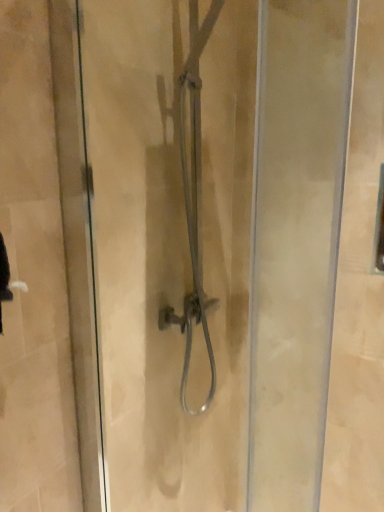
Find the location of `clear glass shower door at center`. clear glass shower door at center is located at coordinates (216, 243).

What is the approximate width of clear glass shower door at center?

The width of clear glass shower door at center is 2.36 inches.

This screenshot has height=512, width=384. What do you see at coordinates (216, 243) in the screenshot?
I see `clear glass shower door at center` at bounding box center [216, 243].

Where is `clear glass shower door at center`? The image size is (384, 512). clear glass shower door at center is located at coordinates (216, 243).